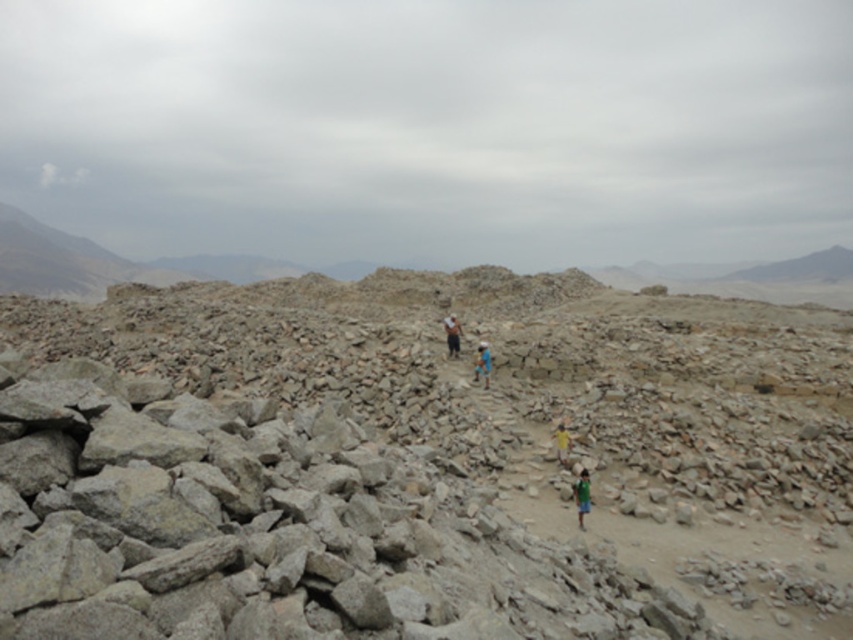
Question: Among these points, which one is farthest from the camera?

Choices:
 (A) (579, 490)
 (B) (564, 465)

Answer: (B)

Question: Can you confirm if light blue fabric at center is wider than yellow fabric person at center?

Choices:
 (A) yes
 (B) no

Answer: (A)

Question: Which point is farther to the camera?

Choices:
 (A) (554, 442)
 (B) (454, 349)
 (C) (483, 374)

Answer: (B)

Question: Is blue fabric shirt at center smaller than light blue fabric at center?

Choices:
 (A) no
 (B) yes

Answer: (A)

Question: Which point appears farthest from the camera in this image?

Choices:
 (A) (560, 449)
 (B) (579, 515)
 (C) (480, 348)

Answer: (C)

Question: Is blue fabric shirt at center wider than yellow fabric person at center?

Choices:
 (A) yes
 (B) no

Answer: (A)